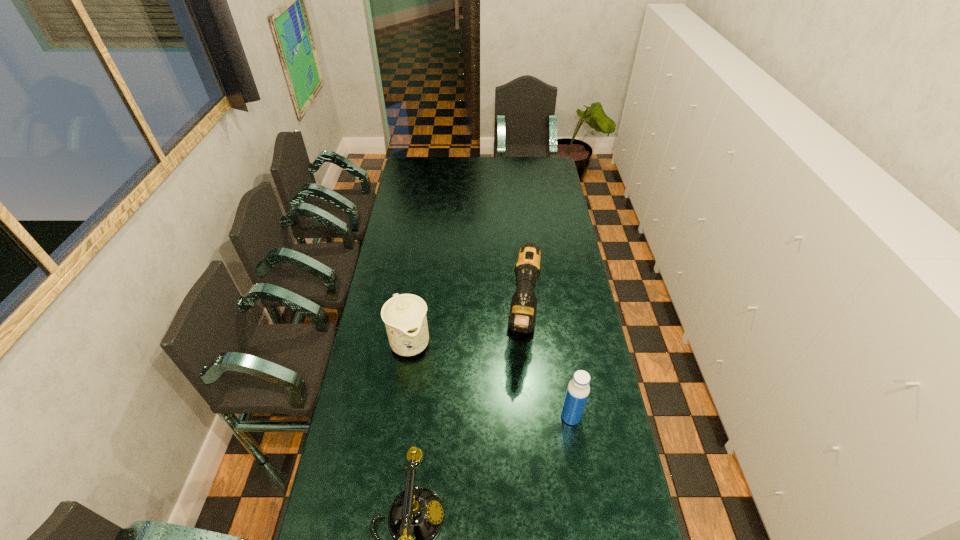
I want to click on free location located on the spout of the chinaware, so click(x=459, y=458).

The height and width of the screenshot is (540, 960). I want to click on free space located 0.210m on the spout of the chinaware, so click(x=437, y=409).

This screenshot has height=540, width=960. I want to click on object that is at the left edge, so click(x=404, y=315).

Image resolution: width=960 pixels, height=540 pixels. Identify the location of object that is at the right edge. (578, 389).

Locate an element on the screen. blank area at the far edge is located at coordinates (475, 173).

Find the location of a particular element. This screenshot has height=540, width=960. free space at the left edge of the desktop is located at coordinates tap(417, 181).

Image resolution: width=960 pixels, height=540 pixels. What are the coordinates of `free point at the right edge` in the screenshot? It's located at (558, 279).

In the image, there is a desktop. Find the location of `vacant space at the far left corner`. vacant space at the far left corner is located at coordinates 426,158.

Locate an element on the screen. This screenshot has height=540, width=960. vacant space at the near left corner of the desktop is located at coordinates (359, 516).

In order to click on free space between the third object from left to right and the second nearest object in this screenshot , I will do `click(547, 372)`.